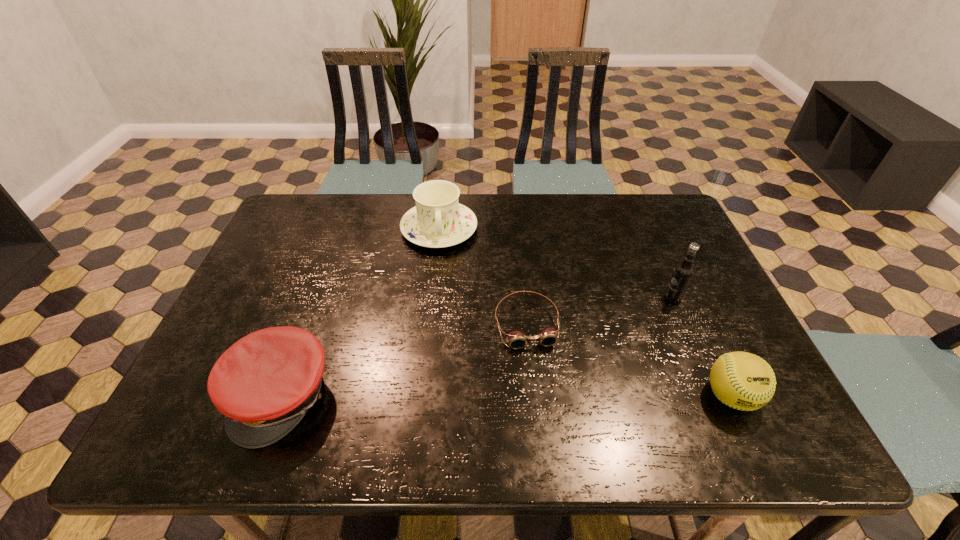
Locate an element on the screen. the third closest object to the tallest object is located at coordinates (438, 220).

Select which object appears as the second closest to the softball. Please provide its 2D coordinates. Your answer should be formatted as a tuple, i.e. [(x, y)], where the tuple contains the x and y coordinates of a point satisfying the conditions above.

[(516, 339)]

The image size is (960, 540). What are the coordinates of `vacant point that satisfies the following two spatial constraints: 1. on the front side of the goggles; 2. on the left side of the second object from left to right` in the screenshot? It's located at (429, 324).